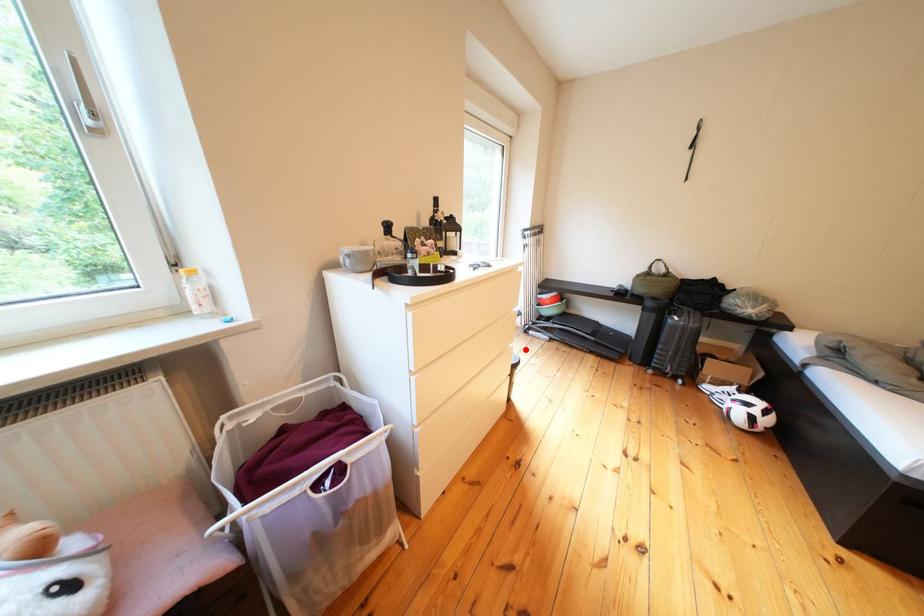
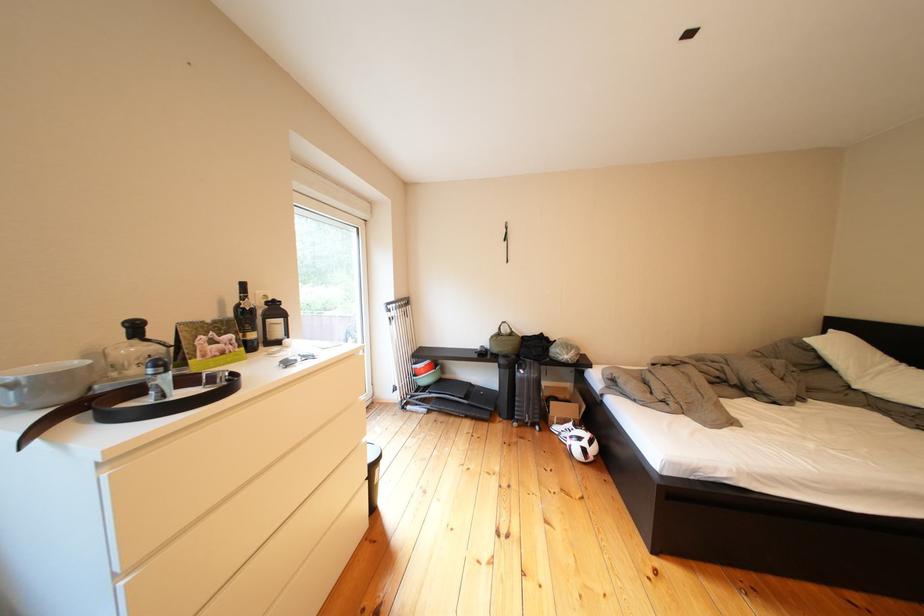
Question: I am providing you with two images of the same scene from different viewpoints. Image1 has a red point marked. In image2, the corresponding 3D location appears at what relative position? Reply with the corresponding letter.

Choices:
 (A) Closer
 (B) Farther

Answer: (A)